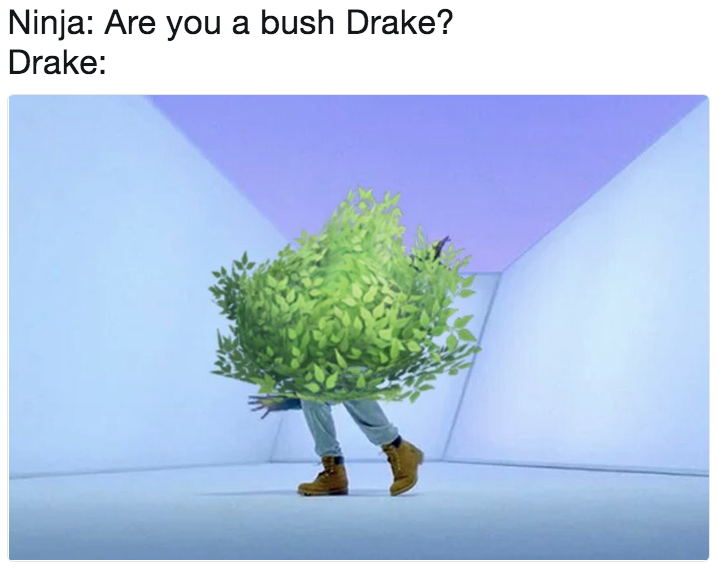
You are a GUI agent. You are given a task and a screenshot of the screen. Output one action in this format:
    pyautogui.click(x=<x>, y=<y>)
    Task: Click on the dark blue ceiling
    
    Given the screenshot: What is the action you would take?
    pyautogui.click(x=445, y=153)